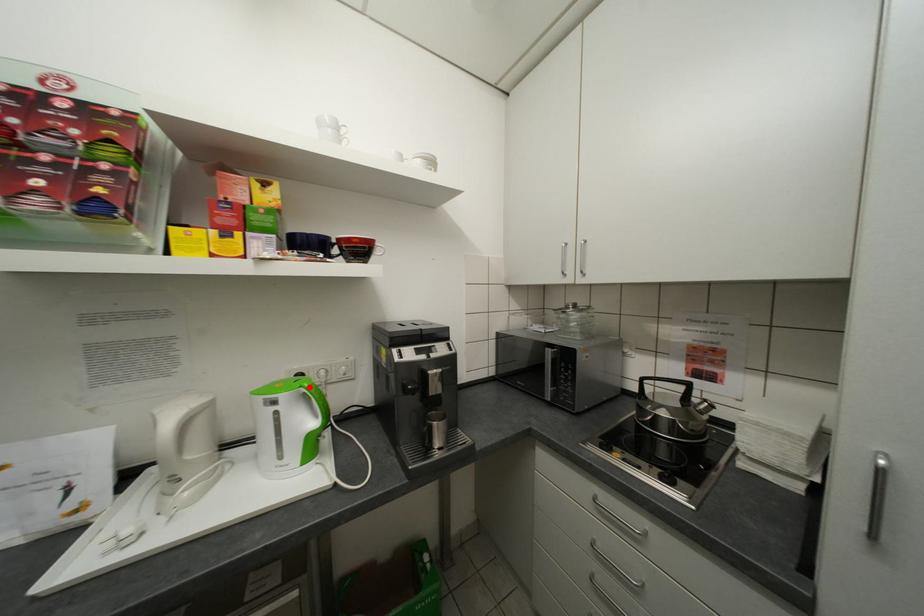
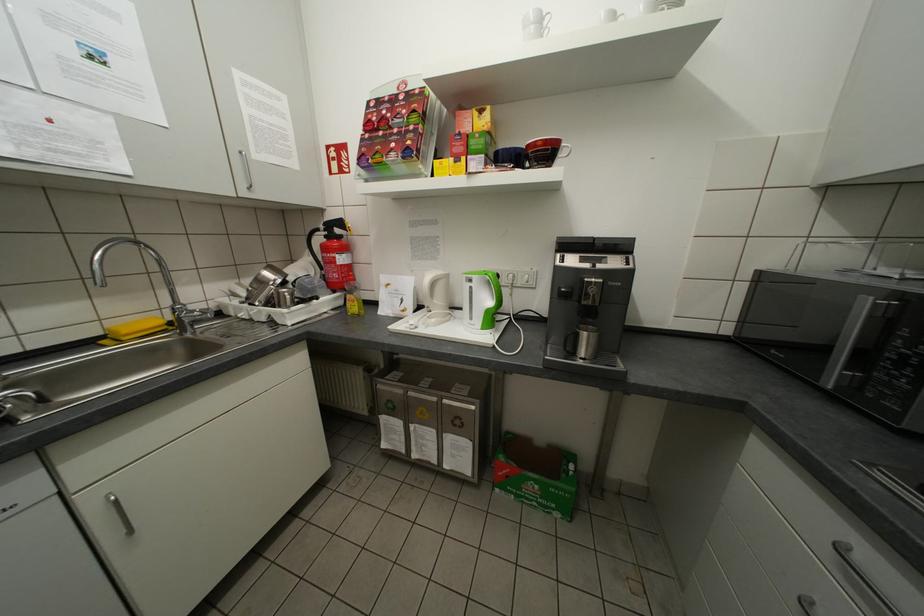
Locate, in the second image, the point that corresponds to the highlighted location in the first image.

(494, 274)